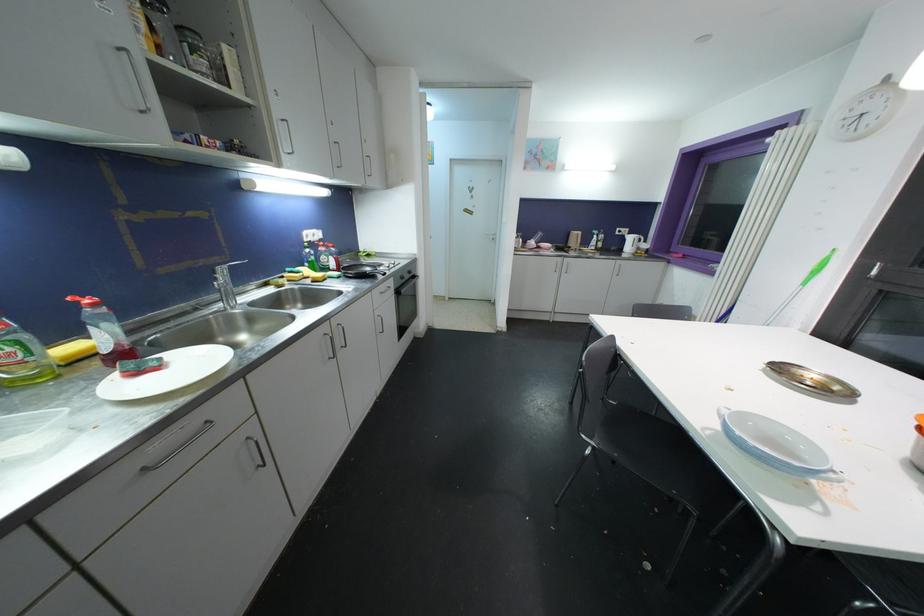
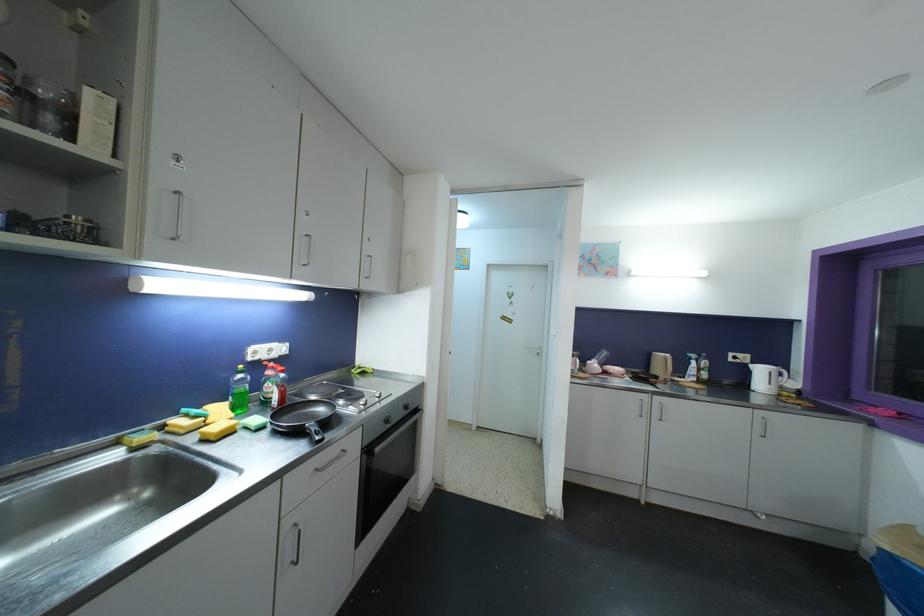
Find the pixel in the second image that matches (634,241) in the first image.

(763, 373)